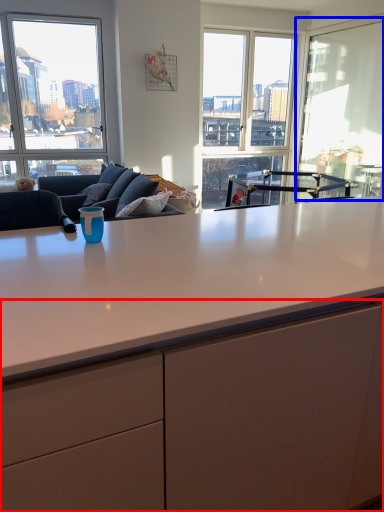
Question: Which point is closer to the camera, cabinetry (highlighted by a red box) or window screen (highlighted by a blue box)?

Choices:
 (A) cabinetry
 (B) window screen

Answer: (A)